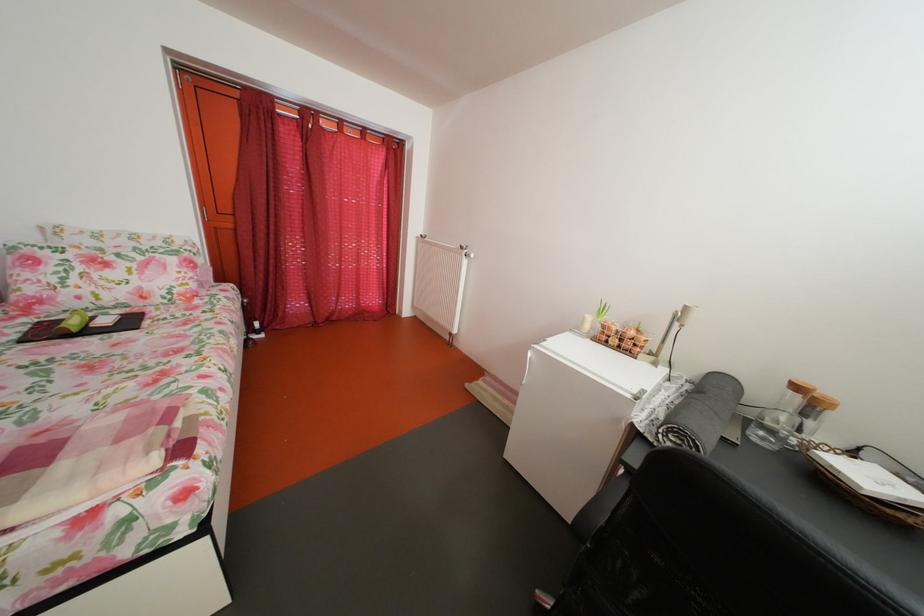
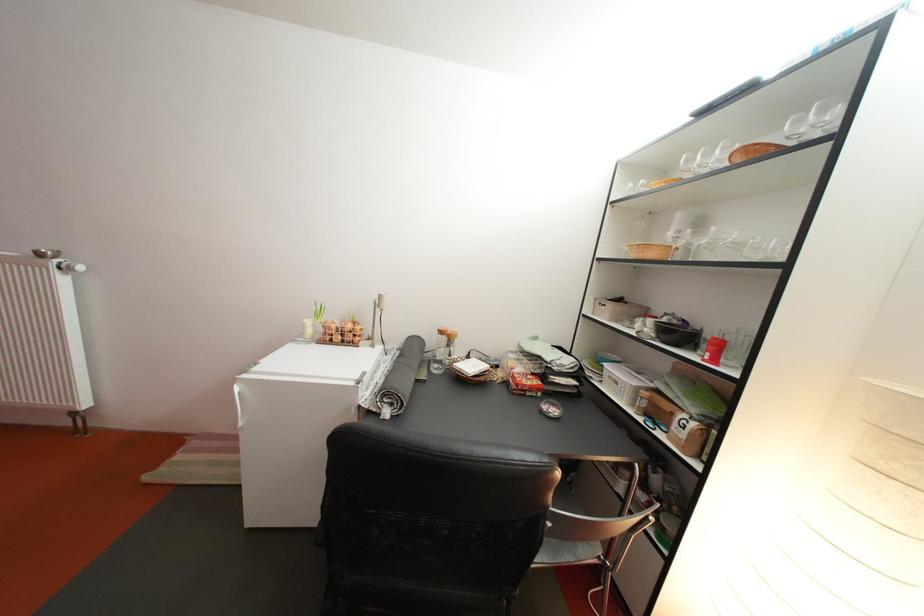
Find the pixel in the second image that matches point 775,399 in the first image.

(444, 346)